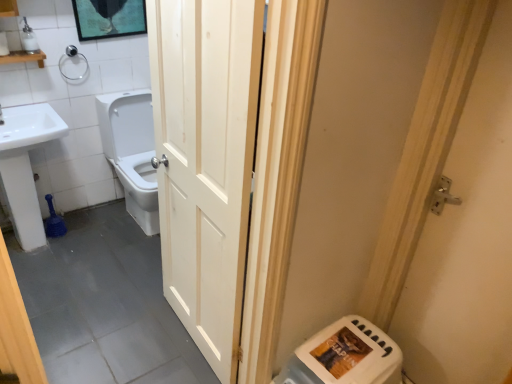
What is the approximate width of satin nickel towel bar at upper left?

satin nickel towel bar at upper left is 1.47 inches in width.

The image size is (512, 384). What do you see at coordinates (71, 57) in the screenshot?
I see `satin nickel towel bar at upper left` at bounding box center [71, 57].

The height and width of the screenshot is (384, 512). Describe the element at coordinates (25, 167) in the screenshot. I see `white ceramic sink at left` at that location.

Image resolution: width=512 pixels, height=384 pixels. Find the location of `white glossy toilet at center`. white glossy toilet at center is located at coordinates (132, 151).

Identify the location of white plastic soap dispenser at upper left. The width and height of the screenshot is (512, 384). (29, 39).

What is the approximate width of white wood door at center, the first door when ordered from left to right?

white wood door at center, the first door when ordered from left to right, is 2.12 inches wide.

Where is `white wooden shelf at upper left`? Image resolution: width=512 pixels, height=384 pixels. white wooden shelf at upper left is located at coordinates coord(24,57).

Is point (72, 51) farther from camera compared to point (22, 187)?

That is True.

At what (x,y) coordinates should I click in order to perform the action: click on sink in front of the satin nickel towel bar at upper left. Please return your answer as a coordinate pair (x, y). This screenshot has width=512, height=384. Looking at the image, I should click on (25, 167).

Does satin nickel towel bar at upper left have a larger size compared to white ceramic sink at left?

No, satin nickel towel bar at upper left is not bigger than white ceramic sink at left.

Can you confirm if satin nickel towel bar at upper left is taller than white ceramic sink at left?

No.

How different are the orientations of satin nickel towel bar at upper left and white wooden shelf at upper left in degrees?

There is a 0.371-degree angle between the facing directions of satin nickel towel bar at upper left and white wooden shelf at upper left.

Is satin nickel towel bar at upper left taller than white wooden shelf at upper left?

Correct, satin nickel towel bar at upper left is much taller as white wooden shelf at upper left.

Is satin nickel towel bar at upper left bigger than white wooden shelf at upper left?

No.

I want to click on balustrade that appears below the satin nickel towel bar at upper left (from the image's perspective), so click(x=24, y=57).

Find the location of a particular element. Image resolution: width=512 pixels, height=384 pixels. water heater that is on the right side of white wooden shelf at upper left is located at coordinates (345, 356).

Is white plastic water heater at lower right oriented towards white wooden shelf at upper left?

No.

From the image's perspective, is white plastic water heater at lower right located beneath white wooden shelf at upper left?

Yes, from the image's perspective, white plastic water heater at lower right is beneath white wooden shelf at upper left.

Where is `balustrade in front of the satin nickel towel bar at upper left`? balustrade in front of the satin nickel towel bar at upper left is located at coordinates (24, 57).

From a real-world perspective, is white wooden shelf at upper left over satin nickel towel bar at upper left?

Indeed, from a real-world perspective, white wooden shelf at upper left stands above satin nickel towel bar at upper left.

Between white wooden shelf at upper left and satin nickel towel bar at upper left, which one appears on the left side from the viewer's perspective?

white wooden shelf at upper left is more to the left.

Measure the distance from white wooden shelf at upper left to satin nickel towel bar at upper left.

white wooden shelf at upper left is 8.25 inches from satin nickel towel bar at upper left.

Are white ceramic sink at left and white plastic water heater at lower right far apart?

That's right, there is a large distance between white ceramic sink at left and white plastic water heater at lower right.

Where is `water heater directly beneath the white ceramic sink at left (from a real-world perspective)`? water heater directly beneath the white ceramic sink at left (from a real-world perspective) is located at coordinates (345, 356).

From the image's perspective, would you say white ceramic sink at left is shown under white plastic water heater at lower right?

No.

From a real-world perspective, is white glossy toilet at center over white wooden shelf at upper left?

No, from a real-world perspective, white glossy toilet at center is not on top of white wooden shelf at upper left.

Is white glossy toilet at center not close to white wooden shelf at upper left?

No, white glossy toilet at center is not far away from white wooden shelf at upper left.

From the image's perspective, is white glossy toilet at center above white wooden shelf at upper left?

Incorrect, from the image's perspective, white glossy toilet at center is lower than white wooden shelf at upper left.

From the picture: Is white glossy toilet at center in front of or behind white wooden shelf at upper left in the image?

white glossy toilet at center is positioned farther from the viewer than white wooden shelf at upper left.

Is white plastic water heater at lower right beside white plastic soap dispenser at upper left?

They are not placed beside each other.

Between white plastic water heater at lower right and white plastic soap dispenser at upper left, which one has more height?

white plastic water heater at lower right is taller.

Is white plastic water heater at lower right to the left of white plastic soap dispenser at upper left from the viewer's perspective?

No.

Locate an element on the screen. The image size is (512, 384). water heater in front of the white plastic soap dispenser at upper left is located at coordinates (345, 356).

Locate an element on the screen. towel bar located behind the white ceramic sink at left is located at coordinates (71, 57).

Where is `towel bar located on the right of white wooden shelf at upper left`? This screenshot has width=512, height=384. towel bar located on the right of white wooden shelf at upper left is located at coordinates (71, 57).

In the scene shown: From the image, which object appears to be nearer to white ceramic sink at left, silver metallic door handle at right, acting as the second door starting from the left, or white plastic water heater at lower right?

white plastic water heater at lower right lies closer to white ceramic sink at left than the other object.

Looking at the image, which one is located closer to white glossy toilet at center, white plastic water heater at lower right or white plastic soap dispenser at upper left?

white plastic soap dispenser at upper left is closer to white glossy toilet at center.

When comparing their distances from satin nickel towel bar at upper left, does white wooden shelf at upper left or white plastic water heater at lower right seem further?

Based on the image, white plastic water heater at lower right appears to be further to satin nickel towel bar at upper left.

Based on their spatial positions, is white plastic water heater at lower right or white glossy toilet at center closer to silver metallic door handle at right, which is the 1th door in right-to-left order?

white plastic water heater at lower right is closer to silver metallic door handle at right, which is the 1th door in right-to-left order.

Estimate the real-world distances between objects in this image. Which object is further from white wooden shelf at upper left, silver metallic door handle at right, acting as the second door starting from the left, or white plastic soap dispenser at upper left?

silver metallic door handle at right, acting as the second door starting from the left.

Which object lies further to the anchor point white wooden shelf at upper left, white wood door at center, the first door when ordered from left to right, or white plastic soap dispenser at upper left?

Among the two, white wood door at center, the first door when ordered from left to right, is located further to white wooden shelf at upper left.

From the image, which object appears to be nearer to silver metallic door handle at right, which is the 1th door in right-to-left order, white wood door at center, the first door when ordered from left to right, or white ceramic sink at left?

The object closer to silver metallic door handle at right, which is the 1th door in right-to-left order, is white wood door at center, the first door when ordered from left to right.

Estimate the real-world distances between objects in this image. Which object is closer to satin nickel towel bar at upper left, silver metallic door handle at right, which is the 1th door in right-to-left order, or white ceramic sink at left?

The object closer to satin nickel towel bar at upper left is white ceramic sink at left.

I want to click on water heater between white ceramic sink at left and silver metallic door handle at right, acting as the second door starting from the left, so click(345, 356).

Identify the location of toilet between white plastic soap dispenser at upper left and white ceramic sink at left in the up-down direction. The image size is (512, 384). (132, 151).

This screenshot has width=512, height=384. I want to click on towel bar between white plastic soap dispenser at upper left and white ceramic sink at left from top to bottom, so click(71, 57).

You are a GUI agent. You are given a task and a screenshot of the screen. Output one action in this format:
    pyautogui.click(x=<x>, y=<y>)
    Task: Click on the toiletry between white wooden shelf at upper left and satin nickel towel bar at upper left along the z-axis
    This screenshot has width=512, height=384.
    Given the screenshot: What is the action you would take?
    pyautogui.click(x=29, y=39)